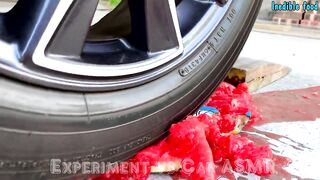
At what (x,y) coordinates should I click in order to perform the action: click on floor. Please return your answer as a coordinate pair (x, y). The width and height of the screenshot is (320, 180). Looking at the image, I should click on (277, 97).